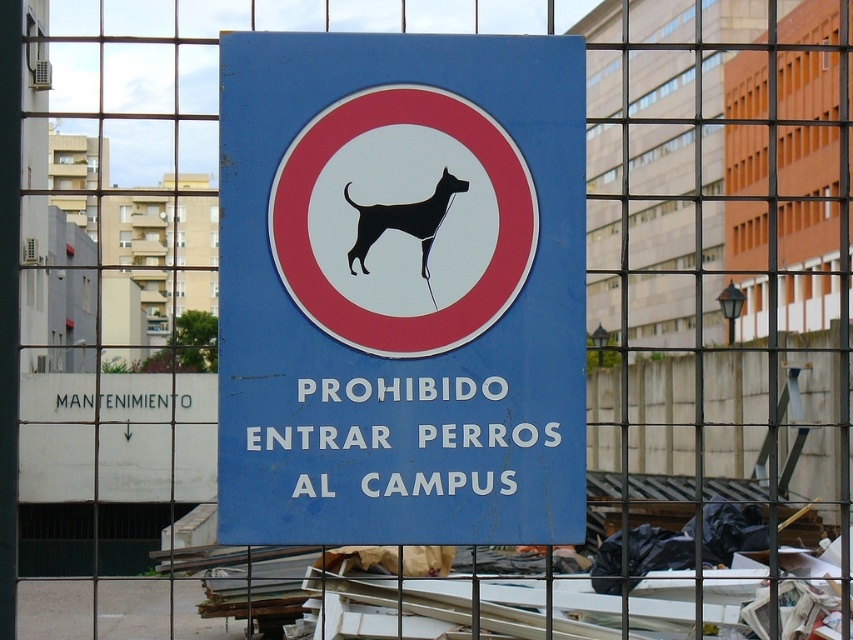
You are a dog owner trying to enter the campus with your dog. You see the blue plastic sign at center and the black silhouette dog at center. According to the sign, are you allowed to bring your dog into the campus?

The blue plastic sign at center states that dogs are prohibited from entering the campus, as indicated by the black silhouette dog at center inside the red circle. Therefore, you are not allowed to bring your dog into the campus.

You are a student carrying a dog leash and your pet dog. You see the blue plastic sign at center and the black silhouette dog at center. According to the sign, can you enter the campus with your dog?

The blue plastic sign at center states that dogs are prohibited from entering the campus, so you cannot enter with your dog.

From the picture: You are a dog owner walking your pet near the campus. You see the blue plastic sign at center and the black silhouette dog at center. According to the sign, can your dog enter the campus area?

The sign states that dogs are prohibited from entering the campus, so your dog cannot enter the campus area.